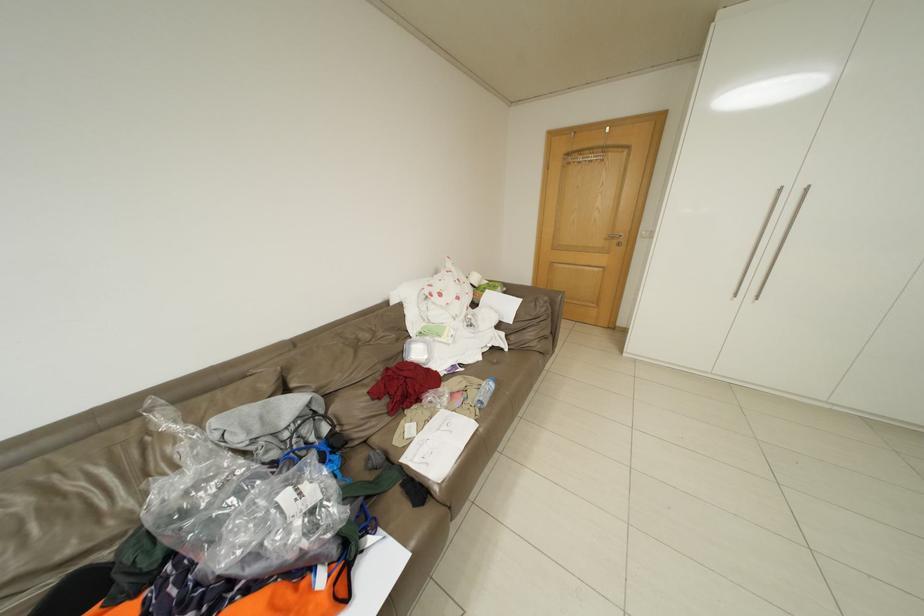
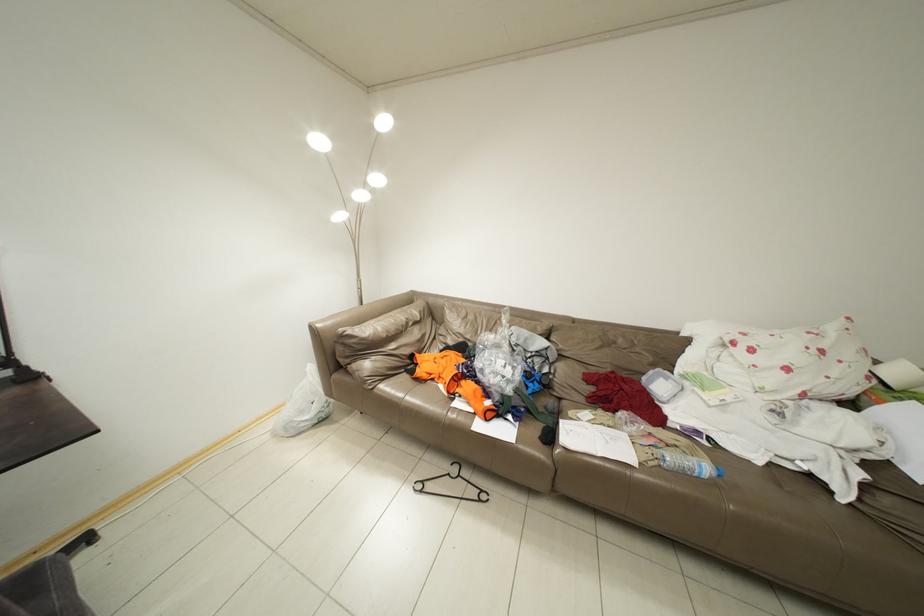
Question: The first image is from the beginning of the video and the second image is from the end. How did the camera likely rotate when shooting the video?

Choices:
 (A) Left
 (B) Right
 (C) Up
 (D) Down

Answer: (A)